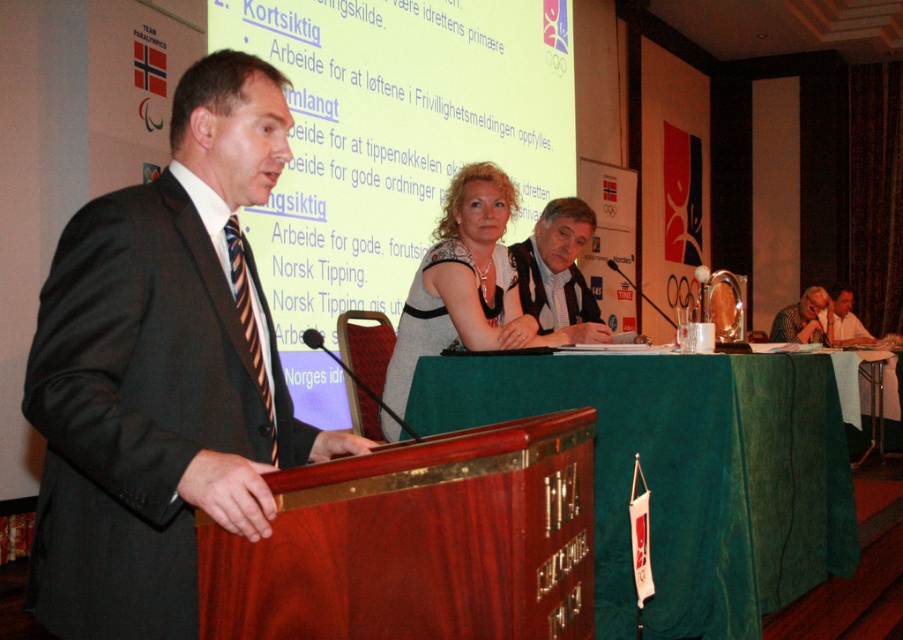
Image resolution: width=903 pixels, height=640 pixels. What do you see at coordinates (684, 474) in the screenshot?
I see `green fabric table at center` at bounding box center [684, 474].

Does green fabric table at center appear on the left side of striped fabric shirt at center?

No, green fabric table at center is not to the left of striped fabric shirt at center.

Is point (678, 560) more distant than point (555, 205)?

No, (678, 560) is closer to viewer.

Locate an element on the screen. The height and width of the screenshot is (640, 903). green fabric table at center is located at coordinates (684, 474).

Is point (135, 422) positioned behind point (272, 428)?

No, (135, 422) is in front of (272, 428).

Is dark brown suit at left wider than striped fabric tie at left?

Indeed, dark brown suit at left has a greater width compared to striped fabric tie at left.

Who is more distant from viewer, (197,413) or (259,365)?

The point (259,365) is more distant.

Identify the location of dark brown suit at left. (163, 371).

Does dark brown suit at left appear over gray textured blouse at center?

No, dark brown suit at left is not above gray textured blouse at center.

Is dark brown suit at left positioned behind gray textured blouse at center?

No, it is not.

Locate an element on the screen. This screenshot has width=903, height=640. dark brown suit at left is located at coordinates (163, 371).